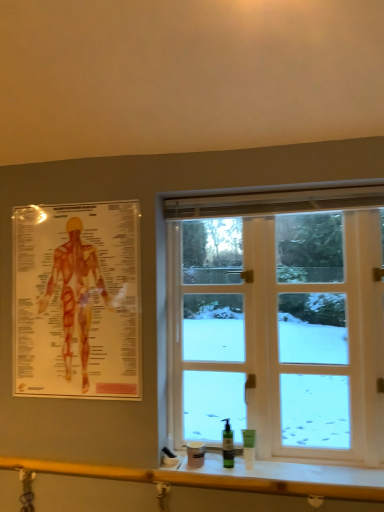
Question: Is wooden at lower center not within white glass window at center?

Choices:
 (A) yes
 (B) no

Answer: (A)

Question: Would you consider wooden at lower center to be distant from white glass window at center?

Choices:
 (A) no
 (B) yes

Answer: (A)

Question: From the image's perspective, would you say wooden at lower center is shown under white glass window at center?

Choices:
 (A) yes
 (B) no

Answer: (A)

Question: Is wooden at lower center with white glass window at center?

Choices:
 (A) yes
 (B) no

Answer: (B)

Question: From a real-world perspective, is wooden at lower center positioned over white glass window at center based on gravity?

Choices:
 (A) yes
 (B) no

Answer: (B)

Question: Considering their positions, is green plastic bottle at lower right, which is counted as the 2th toiletry, starting from the left, located in front of or behind wooden at lower center?

Choices:
 (A) behind
 (B) front

Answer: (A)

Question: From the image's perspective, is green plastic bottle at lower right, which appears as the 1th toiletry when viewed from the right, located above or below wooden at lower center?

Choices:
 (A) above
 (B) below

Answer: (A)

Question: Visually, is green plastic bottle at lower right, which is counted as the 2th toiletry, starting from the left, positioned to the left or to the right of wooden at lower center?

Choices:
 (A) right
 (B) left

Answer: (A)

Question: Looking at their shapes, would you say green plastic bottle at lower right, which is counted as the 2th toiletry, starting from the left, is wider or thinner than wooden at lower center?

Choices:
 (A) wide
 (B) thin

Answer: (B)

Question: From a real-world perspective, is white glass window at center above or below green matte pump bottle at lower center, the 2th toiletry when ordered from right to left?

Choices:
 (A) below
 (B) above

Answer: (B)

Question: Is white glass window at center taller or shorter than green matte pump bottle at lower center, the 2th toiletry when ordered from right to left?

Choices:
 (A) tall
 (B) short

Answer: (A)

Question: Is white glass window at center inside or outside of green matte pump bottle at lower center, arranged as the first toiletry when viewed from the left?

Choices:
 (A) outside
 (B) inside

Answer: (A)

Question: From the image's perspective, relative to green matte pump bottle at lower center, arranged as the first toiletry when viewed from the left, is white glass window at center above or below?

Choices:
 (A) below
 (B) above

Answer: (B)

Question: Is point (4, 463) closer or farther from the camera than point (249, 437)?

Choices:
 (A) closer
 (B) farther

Answer: (A)

Question: Is wooden at lower center inside the boundaries of green plastic bottle at lower right, which appears as the 1th toiletry when viewed from the right, or outside?

Choices:
 (A) outside
 (B) inside

Answer: (A)